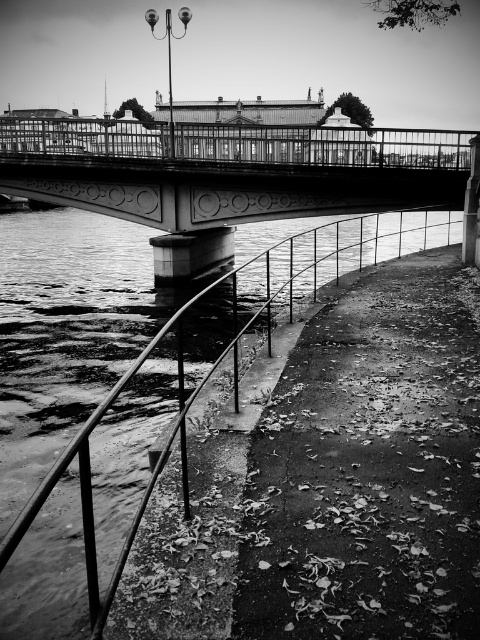
You are standing at the center of the bridge in the image and want to reach the metal railing on the riverside. Which direction should you walk to get to the metal railing at point (63, 333)?

The metal railing at point (63, 333) is located at the lower left, so you should walk towards the lower left direction to reach it.